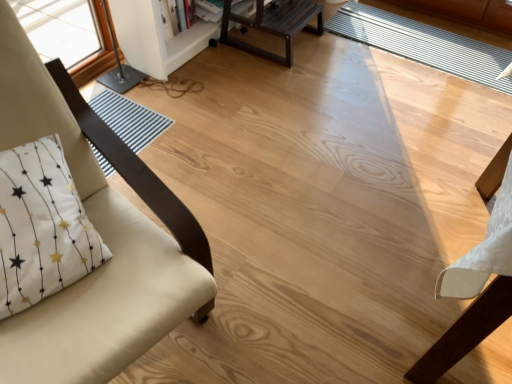
Locate an element on the screen. The image size is (512, 384). free space between beige fabric chair at left and dark brown wood table at upper center is located at coordinates (234, 136).